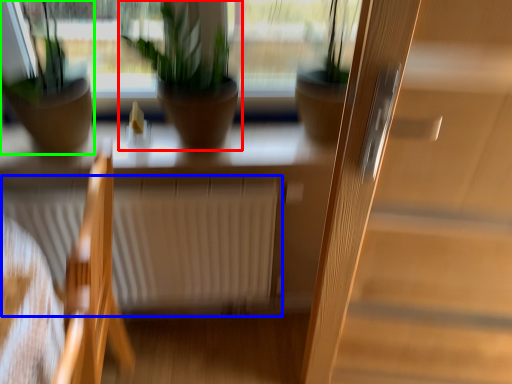
Question: Based on their relative distances, which object is farther from houseplant (highlighted by a red box)? Choose from radiator (highlighted by a blue box) and houseplant (highlighted by a green box).

Choices:
 (A) radiator
 (B) houseplant

Answer: (A)